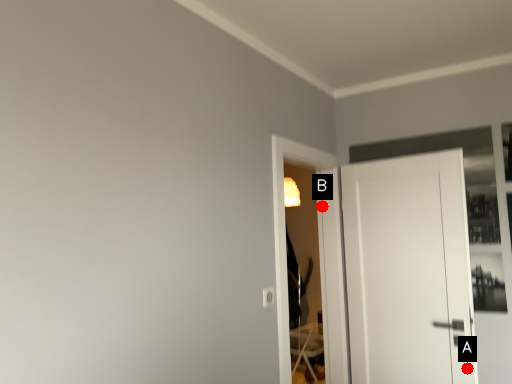
Question: Two points are circled on the image, labeled by A and B beside each circle. Which point appears closest to the camera in this image?

Choices:
 (A) A is closer
 (B) B is closer

Answer: (A)